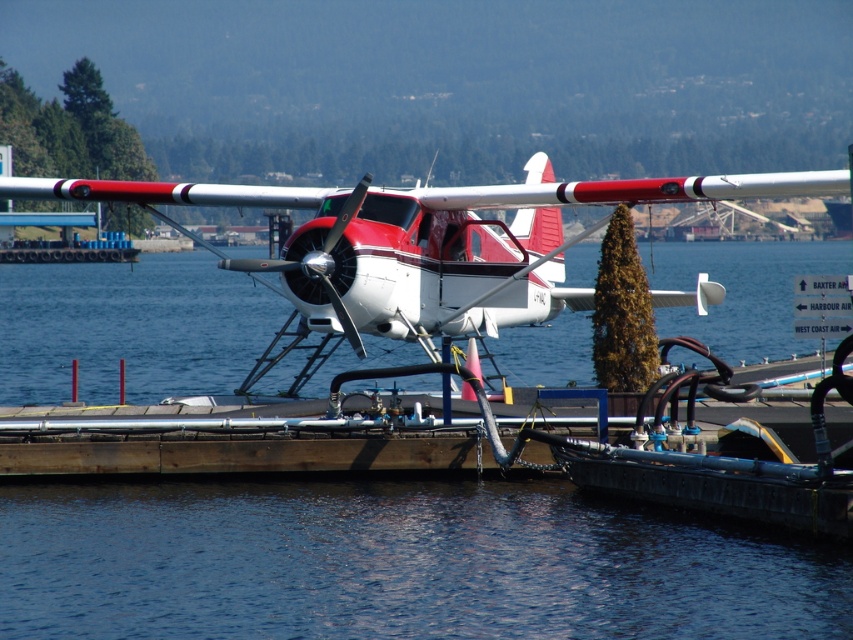
Between point (544, 620) and point (387, 198), which one is positioned in front?

Point (544, 620) is more forward.

Does point (614, 561) come closer to viewer compared to point (405, 252)?

Yes, it is.

Locate an element on the screen. The width and height of the screenshot is (853, 640). blue liquid water at lower center is located at coordinates (397, 564).